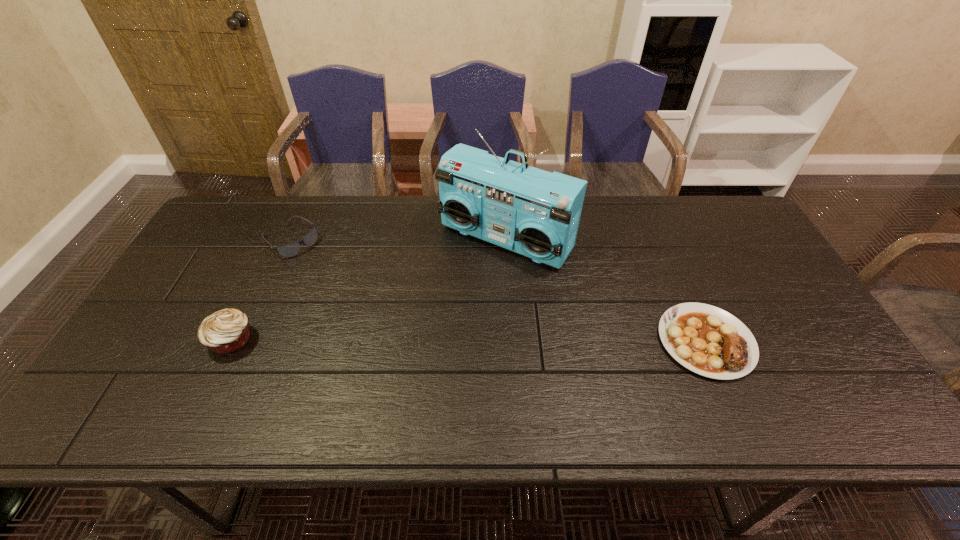
Where is `vacant space located 0.390m on the lenses of the sunglasses`? This screenshot has height=540, width=960. vacant space located 0.390m on the lenses of the sunglasses is located at coordinates (392, 319).

Where is `free point located on the lenses of the sunglasses`? The width and height of the screenshot is (960, 540). free point located on the lenses of the sunglasses is located at coordinates (372, 303).

The width and height of the screenshot is (960, 540). Identify the location of blank space located on the lenses of the sunglasses. (341, 279).

I want to click on radio receiver positioned at the far edge, so click(x=536, y=213).

Identify the location of sunglasses at the far edge. The height and width of the screenshot is (540, 960). (288, 250).

Identify the location of object that is at the near edge. (707, 340).

Locate an element on the screen. This screenshot has width=960, height=540. free location at the far edge is located at coordinates (380, 200).

Image resolution: width=960 pixels, height=540 pixels. In the image, there is a desktop. Identify the location of vacant space at the near edge. (391, 363).

Identify the location of blank space at the left edge of the desktop. The width and height of the screenshot is (960, 540). (173, 291).

At what (x,y) coordinates should I click in order to perform the action: click on vacant space at the right edge of the desktop. Please return your answer as a coordinate pair (x, y). This screenshot has width=960, height=540. Looking at the image, I should click on (771, 264).